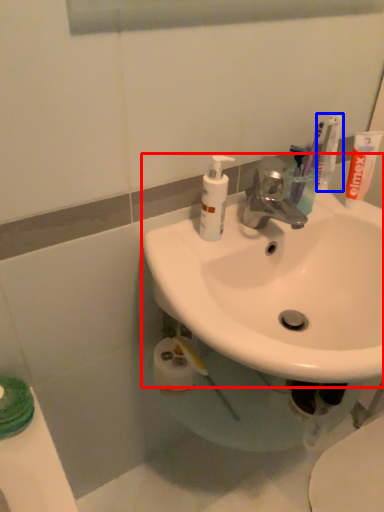
Question: Which of the following is the farthest to the observer, sink (highlighted by a red box) or toothbrush (highlighted by a blue box)?

Choices:
 (A) sink
 (B) toothbrush

Answer: (B)